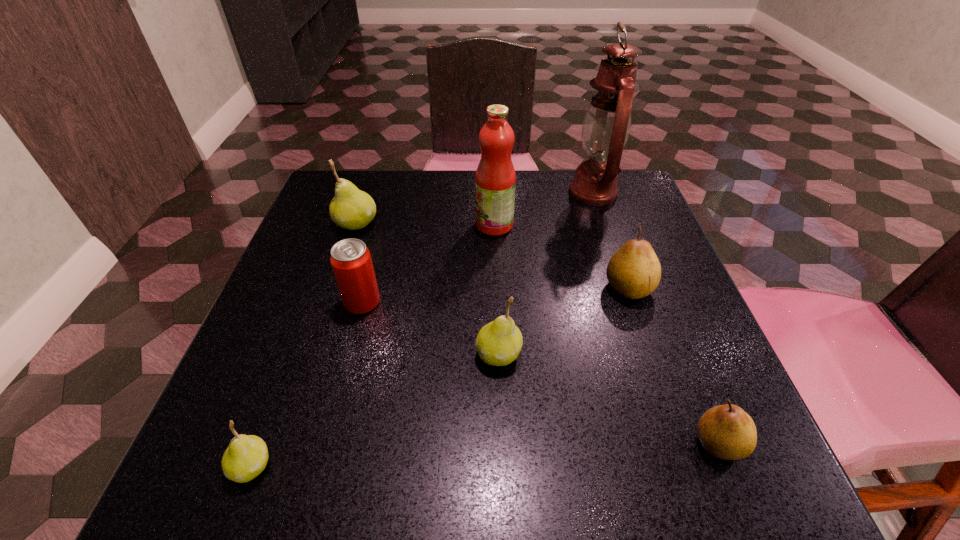
Identify the location of the third farthest pear. (498, 343).

Locate an element on the screen. the nearer brown pear is located at coordinates (727, 432).

Find the location of a particular element. the smallest green pear is located at coordinates click(246, 457).

Where is `vacant space located 0.150m on the front of the red oil lamp`? vacant space located 0.150m on the front of the red oil lamp is located at coordinates (613, 254).

The image size is (960, 540). Identify the location of vacant space located 0.250m on the front label of the fruit juice. (368, 225).

This screenshot has height=540, width=960. I want to click on free space located on the front label of the fruit juice, so click(x=347, y=225).

This screenshot has width=960, height=540. In order to click on vacant position located on the front label of the fruit juice in this screenshot , I will do `click(333, 225)`.

Find the location of `vacant space situated on the right of the tallest pear`. vacant space situated on the right of the tallest pear is located at coordinates (490, 224).

Locate an element on the screen. The image size is (960, 540). vacant space located on the back of the can is located at coordinates (377, 244).

You are a GUI agent. You are given a task and a screenshot of the screen. Output one action in this format:
    pyautogui.click(x=<x>, y=<y>)
    Task: Click on the free region located 0.220m on the back of the bigger brown pear
    This screenshot has height=540, width=960.
    Given the screenshot: What is the action you would take?
    pyautogui.click(x=602, y=209)